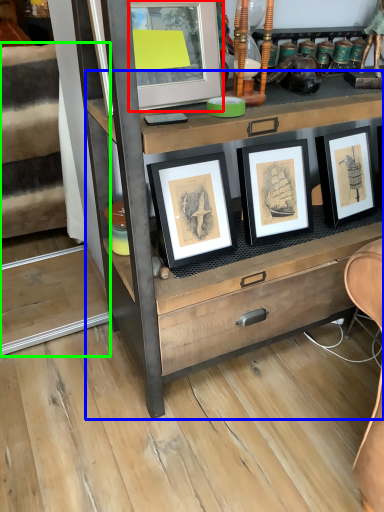
Question: Which object is the farthest from picture frame (highlighted by a red box)? Choose among these: chest of drawers (highlighted by a blue box) or stairwell (highlighted by a green box).

Choices:
 (A) chest of drawers
 (B) stairwell

Answer: (B)